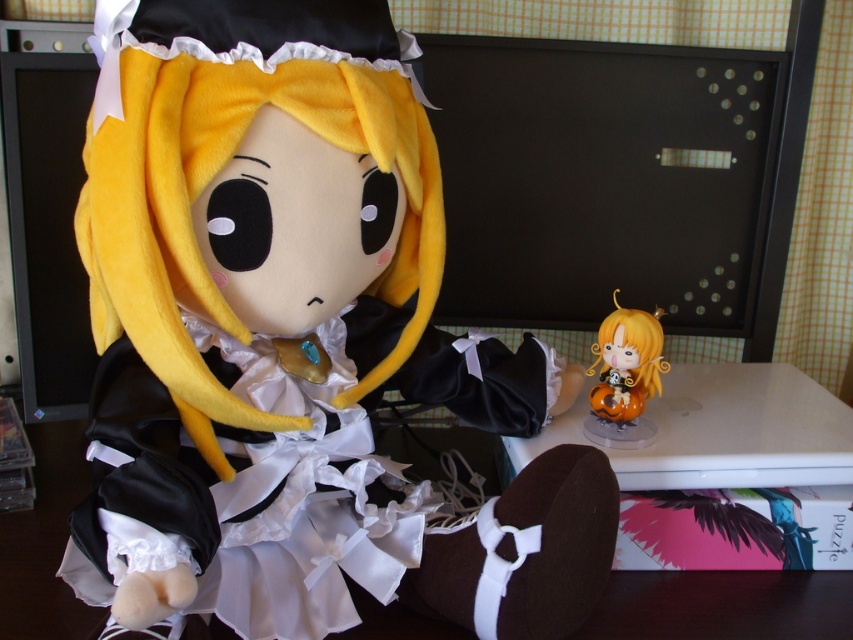
Question: Can you confirm if soft plush doll at center is wider than matte orange figurine at center?

Choices:
 (A) yes
 (B) no

Answer: (A)

Question: Is satin/velvet dress at center above matte orange figurine at center?

Choices:
 (A) yes
 (B) no

Answer: (B)

Question: Based on their relative distances, which object is farther from the soft plush doll at center?

Choices:
 (A) satin/velvet dress at center
 (B) matte orange figurine at center

Answer: (B)

Question: Which of the following is the closest to the observer?

Choices:
 (A) soft plush doll at center
 (B) satin/velvet dress at center

Answer: (A)

Question: Which is nearer to the satin/velvet dress at center?

Choices:
 (A) matte orange figurine at center
 (B) soft plush doll at center

Answer: (B)

Question: Is soft plush doll at center further to the viewer compared to satin/velvet dress at center?

Choices:
 (A) yes
 (B) no

Answer: (B)